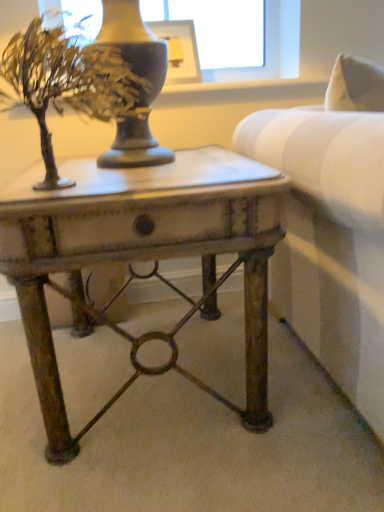
Question: From a real-world perspective, is rustic metal table at center positioned over matte black picture frame at upper center based on gravity?

Choices:
 (A) no
 (B) yes

Answer: (A)

Question: Could you tell me if rustic metal table at center is turned towards matte black picture frame at upper center?

Choices:
 (A) no
 (B) yes

Answer: (A)

Question: Is rustic metal table at center to the left of matte black picture frame at upper center from the viewer's perspective?

Choices:
 (A) no
 (B) yes

Answer: (B)

Question: Is the depth of rustic metal table at center greater than that of matte black picture frame at upper center?

Choices:
 (A) no
 (B) yes

Answer: (A)

Question: Can you confirm if rustic metal table at center is smaller than matte black picture frame at upper center?

Choices:
 (A) no
 (B) yes

Answer: (A)

Question: Considering their positions, is rustic metal table at center located in front of or behind matte black picture frame at upper center?

Choices:
 (A) front
 (B) behind

Answer: (A)

Question: In the image, is rustic metal table at center on the left side or the right side of matte black picture frame at upper center?

Choices:
 (A) left
 (B) right

Answer: (A)

Question: From a real-world perspective, is rustic metal table at center above or below matte black picture frame at upper center?

Choices:
 (A) above
 (B) below

Answer: (B)

Question: Is rustic metal table at center bigger or smaller than matte black picture frame at upper center?

Choices:
 (A) big
 (B) small

Answer: (A)

Question: Does point (157, 36) appear closer or farther from the camera than point (254, 224)?

Choices:
 (A) farther
 (B) closer

Answer: (A)

Question: Considering the positions of matte black picture frame at upper center and rustic metal table at center in the image, is matte black picture frame at upper center bigger or smaller than rustic metal table at center?

Choices:
 (A) big
 (B) small

Answer: (B)

Question: From the image's perspective, is matte black picture frame at upper center located above or below rustic metal table at center?

Choices:
 (A) above
 (B) below

Answer: (A)

Question: Is matte black picture frame at upper center in front of or behind rustic metal table at center in the image?

Choices:
 (A) behind
 (B) front

Answer: (A)

Question: From a real-world perspective, is matte black picture frame at upper center positioned above or below metallic gold tree at upper left?

Choices:
 (A) below
 (B) above

Answer: (B)

Question: Is matte black picture frame at upper center inside or outside of metallic gold tree at upper left?

Choices:
 (A) inside
 (B) outside

Answer: (B)